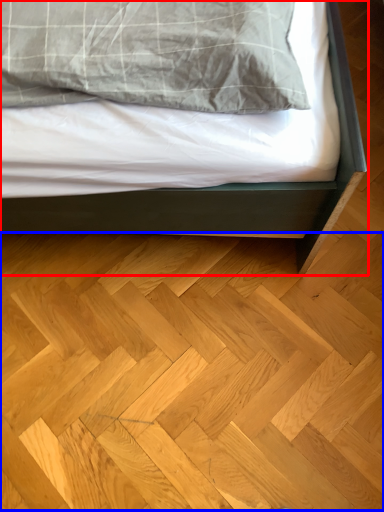
Question: Among these objects, which one is nearest to the camera, bed (highlighted by a red box) or hardwood (highlighted by a blue box)?

Choices:
 (A) bed
 (B) hardwood

Answer: (A)